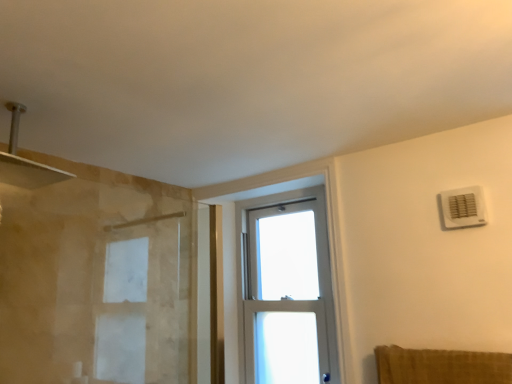
Locate an element on the screen. Image resolution: width=512 pixels, height=384 pixels. clear glass window at center is located at coordinates (286, 289).

Describe the element at coordinates (286, 289) in the screenshot. I see `clear glass window at center` at that location.

Image resolution: width=512 pixels, height=384 pixels. What are the coordinates of `white plastic air conditioning unit at upper right` in the screenshot? It's located at (463, 207).

Image resolution: width=512 pixels, height=384 pixels. What do you see at coordinates (463, 207) in the screenshot?
I see `white plastic air conditioning unit at upper right` at bounding box center [463, 207].

Find the location of a particular element. clear glass window at center is located at coordinates (286, 289).

Is clear glass window at center to the right of white plastic air conditioning unit at upper right from the viewer's perspective?

Incorrect, clear glass window at center is not on the right side of white plastic air conditioning unit at upper right.

Is the position of clear glass window at center more distant than that of white plastic air conditioning unit at upper right?

Yes.

Is point (298, 226) positioned behind point (475, 207)?

Yes, point (298, 226) is behind point (475, 207).

From the image's perspective, between clear glass window at center and white plastic air conditioning unit at upper right, which one is located above?

white plastic air conditioning unit at upper right appears higher in the image.

From a real-world perspective, which is physically above, clear glass window at center or white plastic air conditioning unit at upper right?

white plastic air conditioning unit at upper right, from a real-world perspective.

In terms of width, does clear glass window at center look wider or thinner when compared to white plastic air conditioning unit at upper right?

clear glass window at center is wider than white plastic air conditioning unit at upper right.

Considering the relative sizes of clear glass window at center and white plastic air conditioning unit at upper right in the image provided, is clear glass window at center taller than white plastic air conditioning unit at upper right?

Yes.

Considering the sizes of objects clear glass window at center and white plastic air conditioning unit at upper right in the image provided, who is smaller, clear glass window at center or white plastic air conditioning unit at upper right?

Smaller between the two is white plastic air conditioning unit at upper right.

Choose the correct answer: Is clear glass window at center inside white plastic air conditioning unit at upper right or outside it?

clear glass window at center lies outside white plastic air conditioning unit at upper right.

Is clear glass window at center not near white plastic air conditioning unit at upper right?

clear glass window at center is far away from white plastic air conditioning unit at upper right.

Is clear glass window at center aimed at white plastic air conditioning unit at upper right?

No, clear glass window at center is not oriented towards white plastic air conditioning unit at upper right.

Find the location of `air conditioning that appears above the clear glass window at center (from a real-world perspective)`. air conditioning that appears above the clear glass window at center (from a real-world perspective) is located at coordinates (463, 207).

Considering the relative positions of white plastic air conditioning unit at upper right and clear glass window at center in the image provided, is white plastic air conditioning unit at upper right to the left or to the right of clear glass window at center?

white plastic air conditioning unit at upper right is to the right of clear glass window at center.

Is the depth of white plastic air conditioning unit at upper right greater than that of clear glass window at center?

No, it is in front of clear glass window at center.

Does point (446, 193) lie behind point (330, 316)?

No, (446, 193) is closer to viewer.

From the image's perspective, is white plastic air conditioning unit at upper right on clear glass window at center?

Correct, white plastic air conditioning unit at upper right appears higher than clear glass window at center in the image.

From a real-world perspective, is white plastic air conditioning unit at upper right physically above clear glass window at center?

Yes.

Between white plastic air conditioning unit at upper right and clear glass window at center, which one has smaller width?

Thinner between the two is white plastic air conditioning unit at upper right.

Can you confirm if white plastic air conditioning unit at upper right is taller than clear glass window at center?

In fact, white plastic air conditioning unit at upper right may be shorter than clear glass window at center.

Which of these two, white plastic air conditioning unit at upper right or clear glass window at center, is bigger?

With larger size is clear glass window at center.

Is white plastic air conditioning unit at upper right outside of clear glass window at center?

Yes, white plastic air conditioning unit at upper right is located beyond the bounds of clear glass window at center.

Are white plastic air conditioning unit at upper right and clear glass window at center located far from each other?

Yes, white plastic air conditioning unit at upper right and clear glass window at center are located far from each other.

Does white plastic air conditioning unit at upper right turn towards clear glass window at center?

No, white plastic air conditioning unit at upper right is not facing towards clear glass window at center.

This screenshot has height=384, width=512. Identify the location of window below the white plastic air conditioning unit at upper right (from a real-world perspective). [x=286, y=289].

In the image, there is a white plastic air conditioning unit at upper right. Where is `window below it (from a real-world perspective)`? The image size is (512, 384). window below it (from a real-world perspective) is located at coordinates (286, 289).

Identify the location of window behind the white plastic air conditioning unit at upper right. (286, 289).